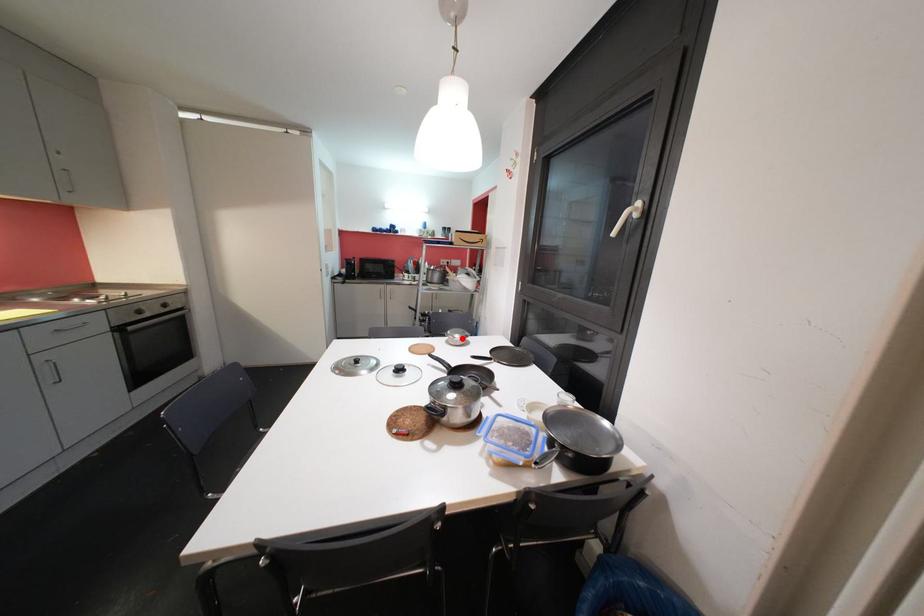
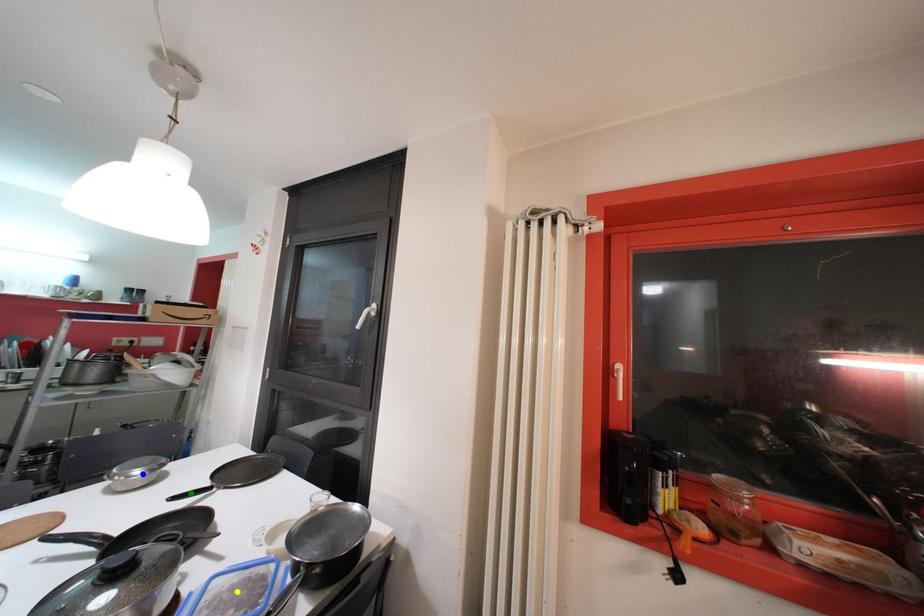
Question: I am providing you with two images of the same scene from different viewpoints. A red point is marked on the first image. You are given multiple points on the second image. Which spot in image 2 lines up with the point in image 1?

Choices:
 (A) yellow point
 (B) blue point
 (C) green point

Answer: (B)